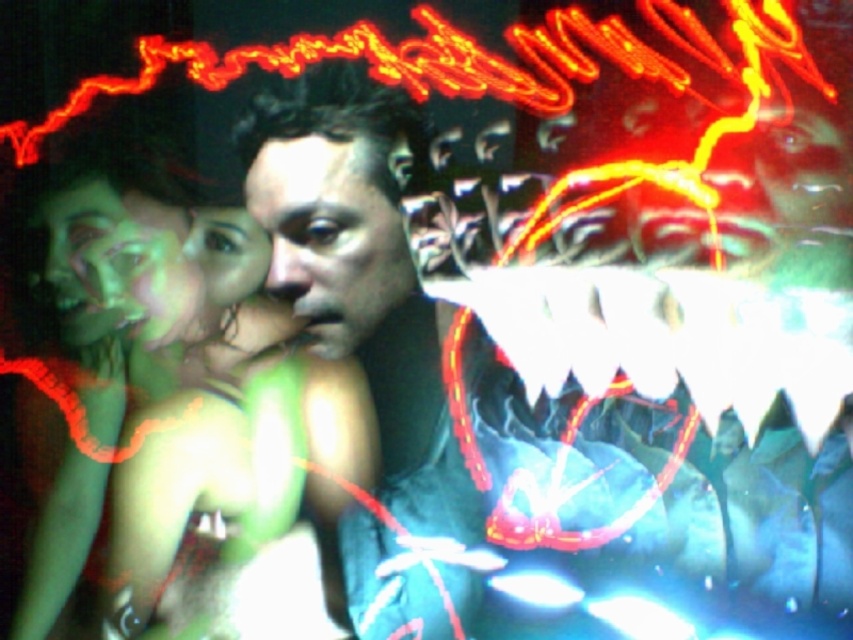
Who is shorter, smooth skin face at center or smooth green skin at center?

smooth green skin at center is shorter.

Who is taller, smooth skin face at center or smooth green skin at center?

With more height is smooth skin face at center.

Find the location of a particular element. smooth skin face at center is located at coordinates (334, 232).

Which is above, blue fabric at center or shiny plastic face at upper right?

shiny plastic face at upper right is higher up.

Is blue fabric at center smaller than shiny plastic face at upper right?

Incorrect, blue fabric at center is not smaller in size than shiny plastic face at upper right.

At what (x,y) coordinates should I click in order to perform the action: click on blue fabric at center. Please return your answer as a coordinate pair (x, y). Looking at the image, I should click on (648, 346).

Looking at this image, between green matte skin at center and green matte face at upper left, which one is positioned lower?

green matte skin at center

Who is higher up, green matte skin at center or green matte face at upper left?

green matte face at upper left is above.

Find the location of a particular element. The image size is (853, 640). green matte skin at center is located at coordinates (164, 396).